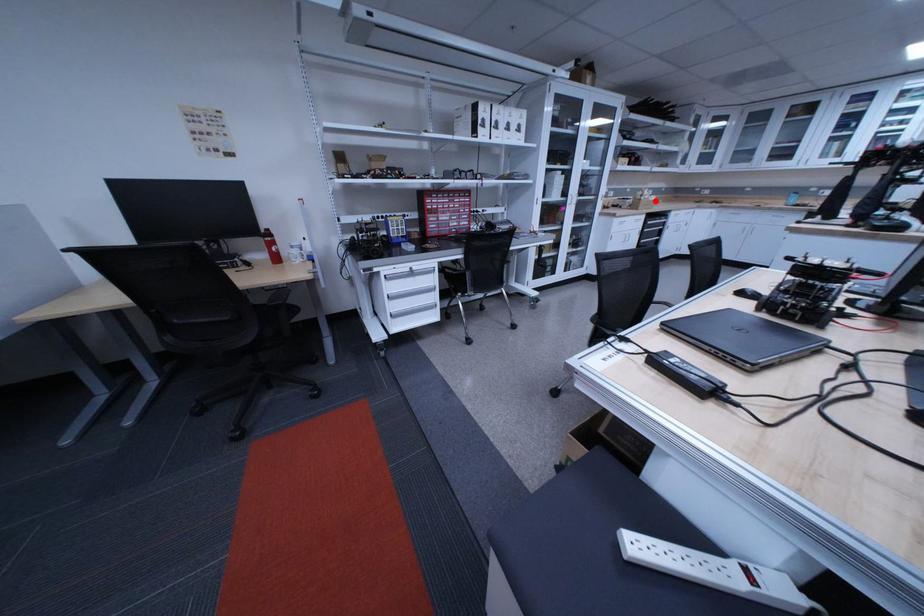
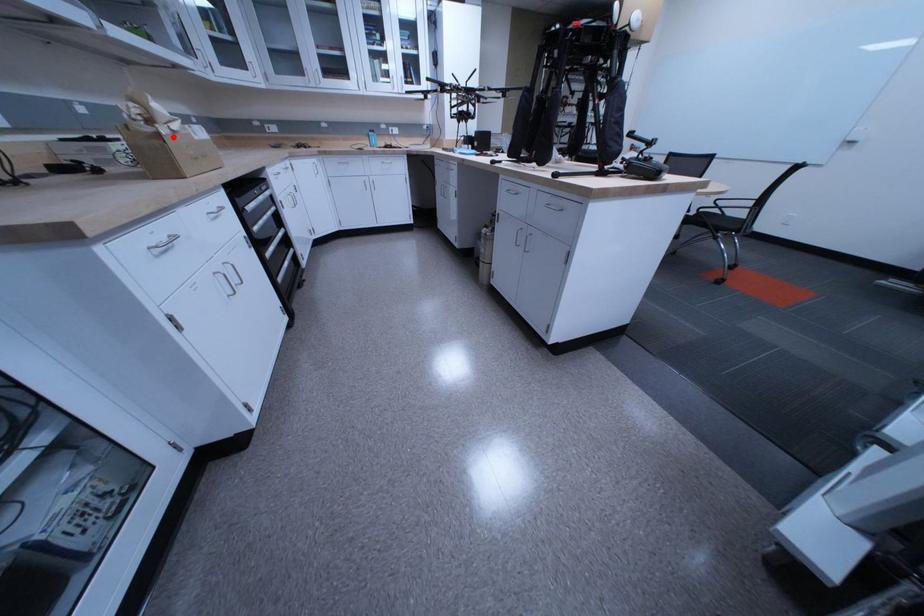
I am providing you with two images of the same scene from different viewpoints. A red point is marked on the first image and another point is marked on the second image. Are the points marked in image1 and image2 representing the same 3D position?

Yes